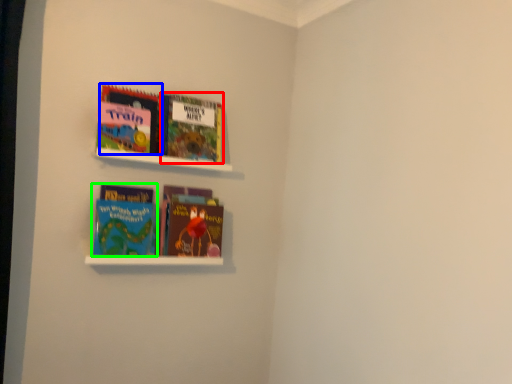
Question: Based on their relative distances, which object is farther from book (highlighted by a red box)? Choose from book (highlighted by a blue box) and book (highlighted by a green box).

Choices:
 (A) book
 (B) book

Answer: (B)